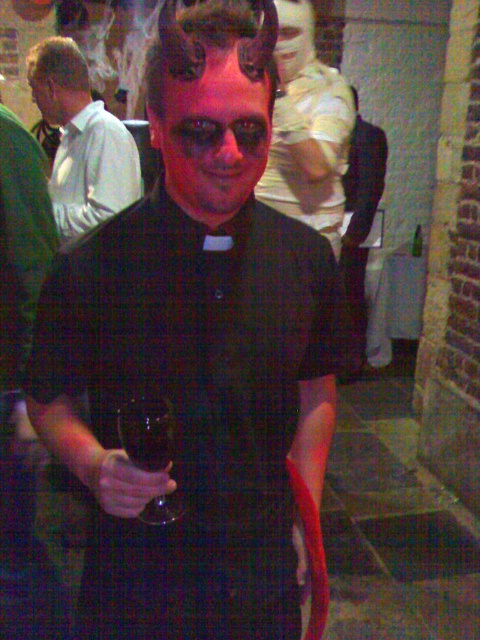
Question: Can you confirm if black matte shirt at center is wider than matte black shirt at center?

Choices:
 (A) no
 (B) yes

Answer: (B)

Question: Which point is farther to the camera?

Choices:
 (A) matte white shirt at left
 (B) matte black wine glass at center

Answer: (A)

Question: Among these points, which one is farthest from the camera?

Choices:
 (A) (334, 145)
 (B) (118, 456)
 (C) (69, 230)
 (D) (253, 301)

Answer: (C)

Question: Which point is farther to the camera?

Choices:
 (A) (32, 84)
 (B) (354, 116)
 (C) (164, 483)

Answer: (A)

Question: Does matte white shirt at left appear on the right side of matte black wine glass at center?

Choices:
 (A) yes
 (B) no

Answer: (B)

Question: Does matte white shirt at left have a smaller size compared to matte black wine glass at center?

Choices:
 (A) no
 (B) yes

Answer: (A)